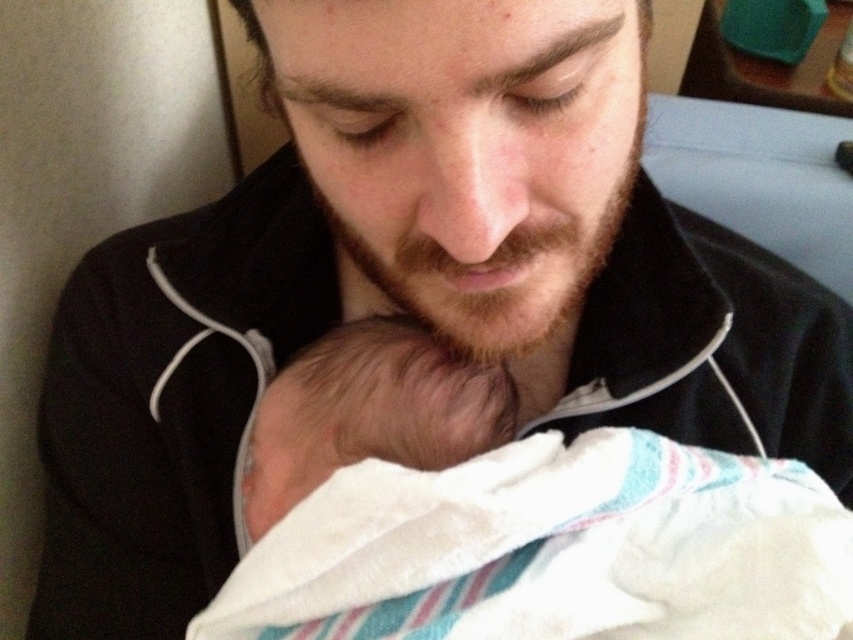
Question: Which point is closer to the camera?

Choices:
 (A) (297, 429)
 (B) (432, 365)

Answer: (A)

Question: Does soft white blanket at lower center have a lesser width compared to soft beige skin at center?

Choices:
 (A) no
 (B) yes

Answer: (A)

Question: Considering the relative positions of soft white blanket at lower center and soft beige skin at center in the image provided, where is soft white blanket at lower center located with respect to soft beige skin at center?

Choices:
 (A) left
 (B) right

Answer: (B)

Question: Is soft white blanket at lower center further to camera compared to soft beige skin at center?

Choices:
 (A) no
 (B) yes

Answer: (A)

Question: Which point is closer to the camera?

Choices:
 (A) (633, 454)
 (B) (270, 486)

Answer: (B)